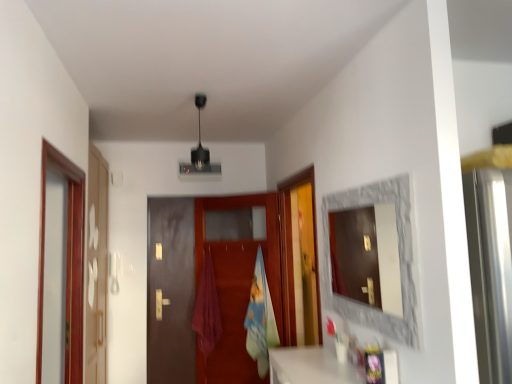
Question: From the image's perspective, relative to brown wooden screen door at left, the 2th screen door in the back-to-front sequence, is white glossy screen door at left, acting as the first screen door starting from the back, above or below?

Choices:
 (A) below
 (B) above

Answer: (A)

Question: Is white glossy screen door at left, the 2th screen door when ordered from front to back, bigger or smaller than brown wooden screen door at left, which is the first screen door in front-to-back order?

Choices:
 (A) big
 (B) small

Answer: (A)

Question: Considering the real-world distances, which object is closest to the pink fabric towel at center?

Choices:
 (A) brown wooden screen door at left, which is the first screen door in front-to-back order
 (B) stone textured mirror at right
 (C) blue cotton beach towel at center
 (D) brown matte door at center
 (E) white glossy screen door at left, the 2th screen door when ordered from front to back

Answer: (D)

Question: Estimate the real-world distances between objects in this image. Which object is farther from the blue cotton beach towel at center?

Choices:
 (A) brown matte door at center
 (B) white glossy screen door at left, acting as the first screen door starting from the back
 (C) pink fabric towel at center
 (D) brown wooden screen door at left, which is the first screen door in front-to-back order
 (E) stone textured mirror at right

Answer: (D)